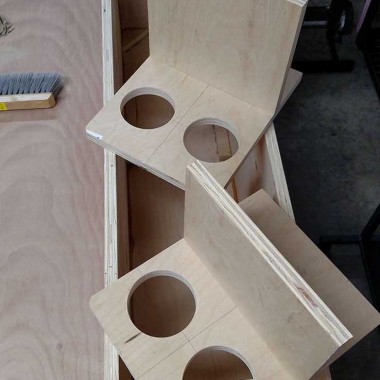
Find the location of `right side of cup holder`. right side of cup holder is located at coordinates (314, 268), (284, 77).